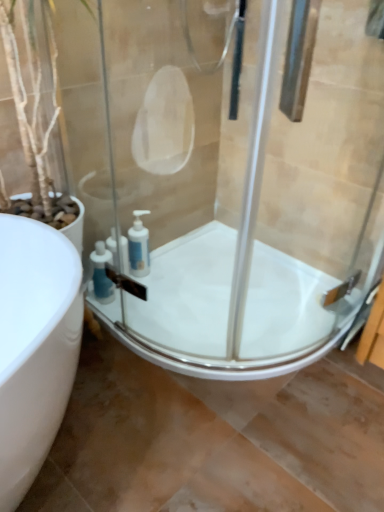
Question: Is white glossy bath at center wider or thinner than transparent glass shower door at center?

Choices:
 (A) wide
 (B) thin

Answer: (A)

Question: Is white glossy bath at center situated inside transparent glass shower door at center or outside?

Choices:
 (A) inside
 (B) outside

Answer: (B)

Question: Based on their relative distances, which object is farther from the white glossy soap dispenser at corner, which is counted as the first soap dispenser, starting from the right?

Choices:
 (A) blue plastic soap dispenser at lower center, the 1th soap dispenser in the left-to-right sequence
 (B) transparent glass shower door at center
 (C) white glossy bath at center

Answer: (B)

Question: Estimate the real-world distances between objects in this image. Which object is farther from the white glossy bath at center?

Choices:
 (A) white glossy soap dispenser at corner, arranged as the second soap dispenser when viewed from the left
 (B) transparent glass shower door at center
 (C) blue plastic soap dispenser at lower center, the 2th soap dispenser when ordered from right to left

Answer: (C)